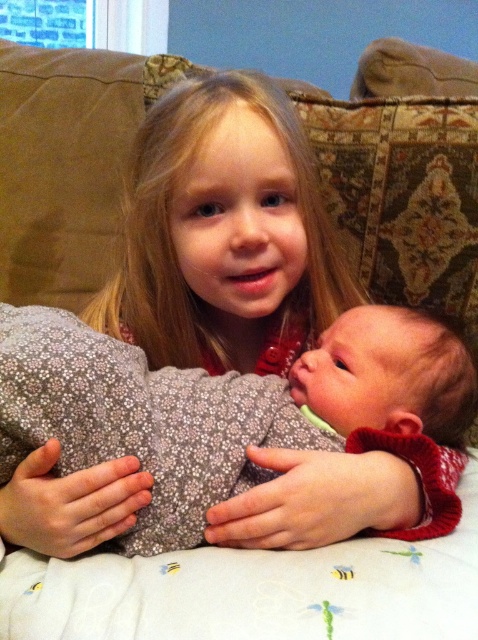
Where is the fluffy gray blanket at center located in the image?

The fluffy gray blanket at center is located at point (239, 416) in the image.

You are a photographer taking a picture of the two children. You notice the fluffy gray blanket at center and the blonde hair at upper center. How far apart are these two elements in inches?

The fluffy gray blanket at center and the blonde hair at upper center are 6.71 inches apart from each other.

You are a photographer setting up a shoot in this scene. You need to place a small prop between the fluffy gray blanket at center and the blonde hair at upper center. Based on their heights, which object should the prop be placed closer to?

The fluffy gray blanket at center has a lesser height compared to blonde hair at upper center, so the prop should be placed closer to the fluffy gray blanket at center to maintain balance between the two objects.